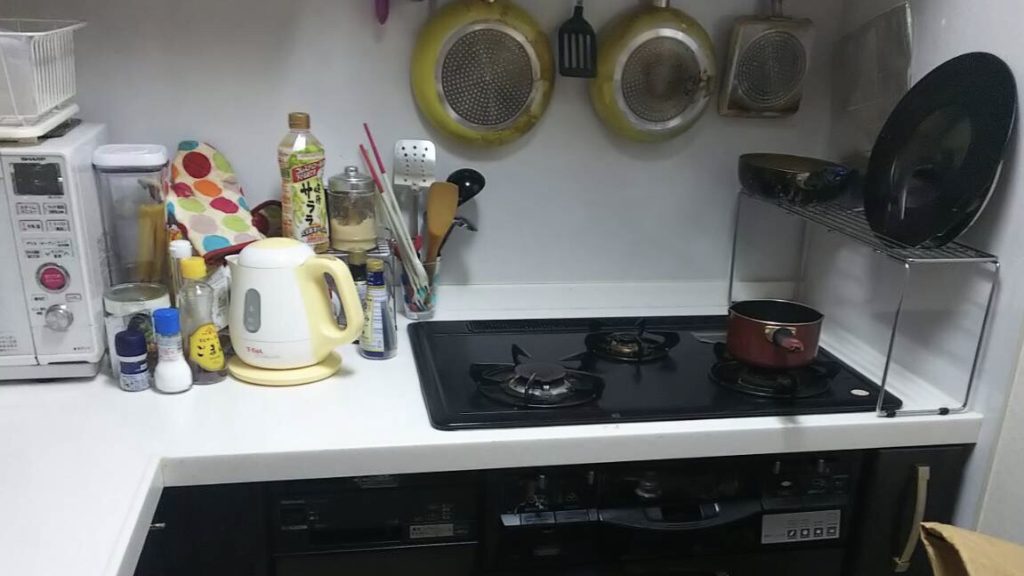
Locate an element on the screen. This screenshot has height=576, width=1024. oven door is located at coordinates (693, 558).